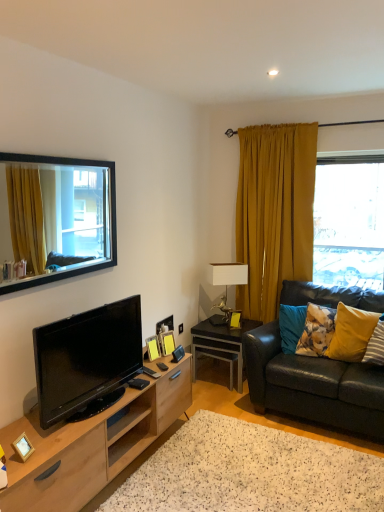
Question: Visually, is yellow fabric pillow at right, which is counted as the second pillow, starting from the right, positioned to the left or to the right of black glossy side table at lower right?

Choices:
 (A) left
 (B) right

Answer: (B)

Question: Relative to black glossy side table at lower right, is yellow fabric pillow at right, which is counted as the second pillow, starting from the right, in front or behind?

Choices:
 (A) front
 (B) behind

Answer: (A)

Question: Based on their relative distances, which object is nearer to the yellow velvet pillow at right, the 1th pillow in the right-to-left sequence?

Choices:
 (A) black glossy tv at lower left
 (B) floral fabric pillow at right, the 3th pillow positioned from the right
 (C) wooden picture frame at lower left, the first picture frame when ordered from front to back
 (D) white speckled rug at lower center
 (E) yellow fabric pillow at right, which is counted as the second pillow, starting from the right

Answer: (E)

Question: Based on their relative distances, which object is nearer to the white speckled rug at lower center?

Choices:
 (A) transparent glass window at upper right, the 1th window from the back
 (B) wooden picture frame at center, arranged as the 2th picture frame when viewed from the front
 (C) yellow velvet pillow at right, the 3th pillow when ordered from left to right
 (D) wooden picture frame at lower left, marked as the 4th picture frame in a right-to-left arrangement
 (E) black glossy side table at lower right

Answer: (B)